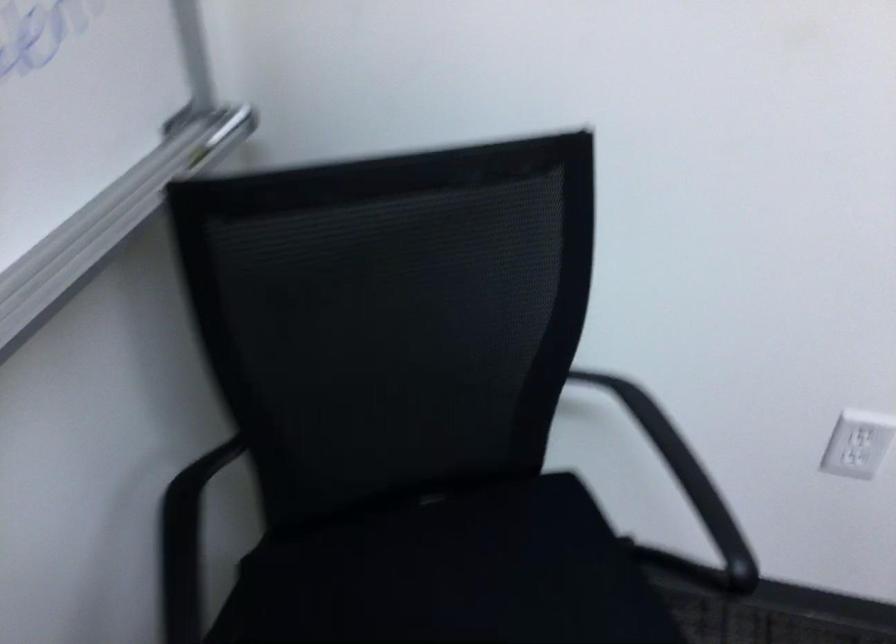
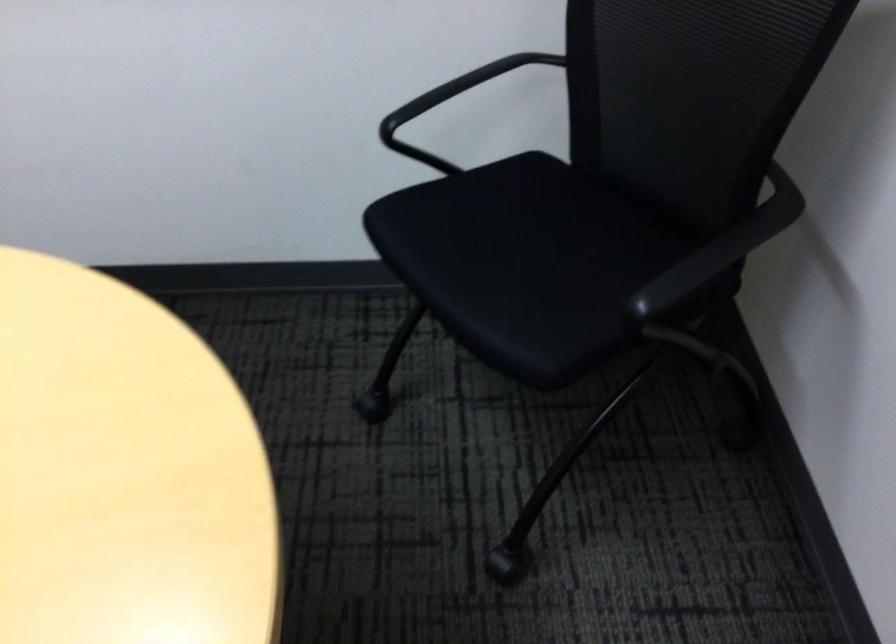
Based on the continuous images, in which direction is the camera rotating?

The camera rotated toward left-down.